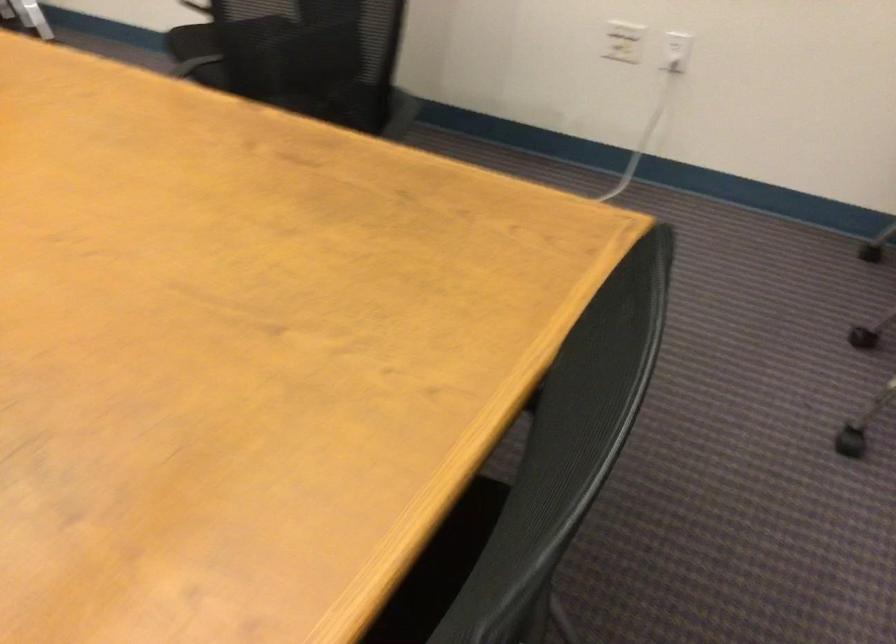
Find where to plugging in the electrical outlet. Please return your answer as a coordinate pair (x, y).

(676, 51)